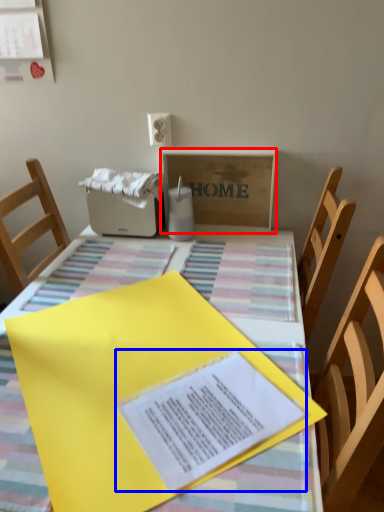
Question: Among these objects, which one is farthest to the camera, cardboard box (highlighted by a red box) or journal (highlighted by a blue box)?

Choices:
 (A) cardboard box
 (B) journal

Answer: (A)